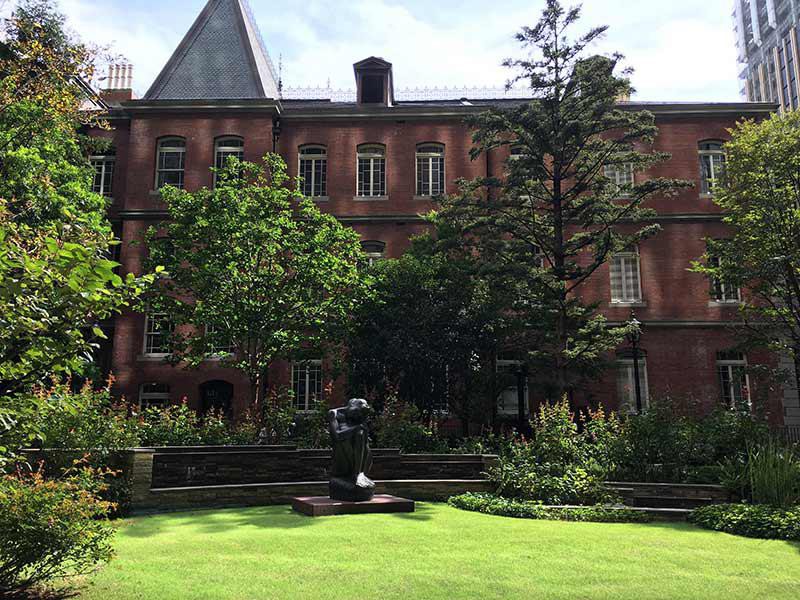
The height and width of the screenshot is (600, 800). I want to click on doorway, so click(214, 399).